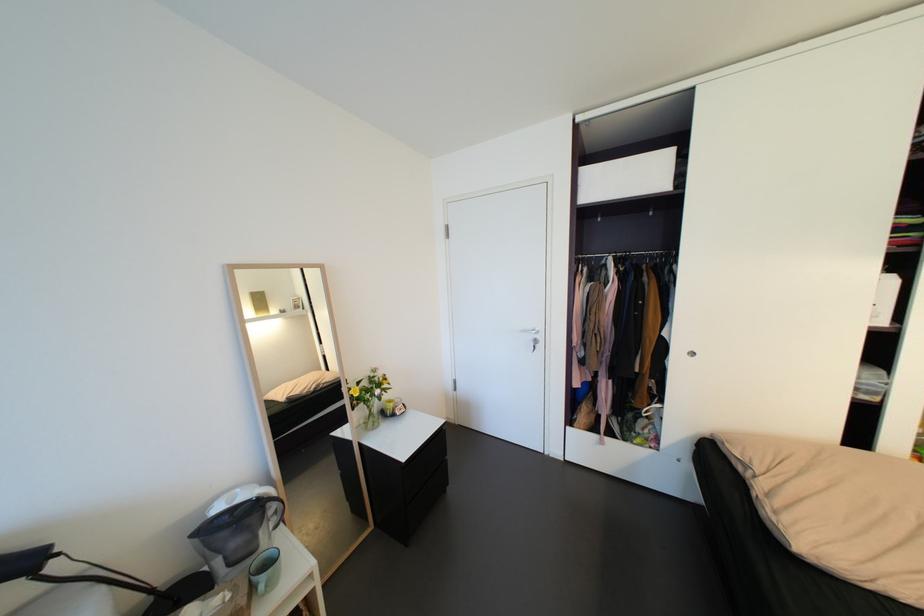
Where is `white storage box`? white storage box is located at coordinates (884, 300).